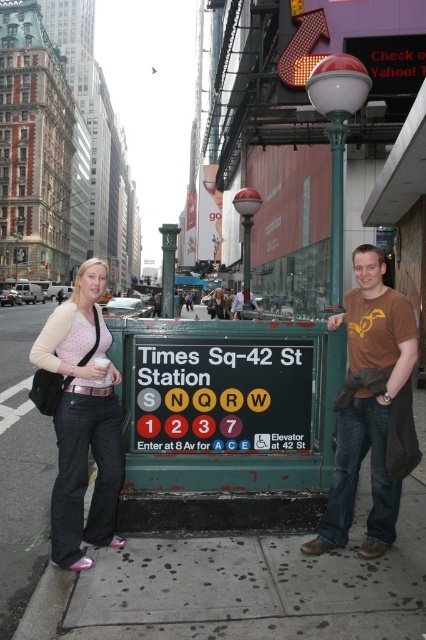
Is black plastic sign at center positioned before matte black jacket at center?

Yes.

Measure the distance between black plastic sign at center and camera.

13.35 feet

Is point (261, 396) less distant than point (222, 296)?

Yes, it is.

What are the coordinates of `black plastic sign at center` in the screenshot? It's located at (221, 394).

Who is more forward, (219,308) or (222,294)?

Point (219,308) is more forward.

Is point (232, 310) farther from viewer compared to point (215, 307)?

No.

Does point (207, 305) lie behind point (229, 314)?

Yes, point (207, 305) is farther from viewer.

This screenshot has width=426, height=640. In order to click on matte black jacket at center in this screenshot , I will do `click(230, 305)`.

Which is above, green concrete pavement at center or metallic silver streetlamp at center?

metallic silver streetlamp at center is above.

Between green concrete pavement at center and metallic silver streetlamp at center, which one appears on the left side from the viewer's perspective?

green concrete pavement at center is more to the left.

Does point (2, 483) come farther from viewer compared to point (247, 202)?

No, it is in front of (247, 202).

Where is `green concrete pavement at center`? The image size is (426, 640). green concrete pavement at center is located at coordinates (190, 550).